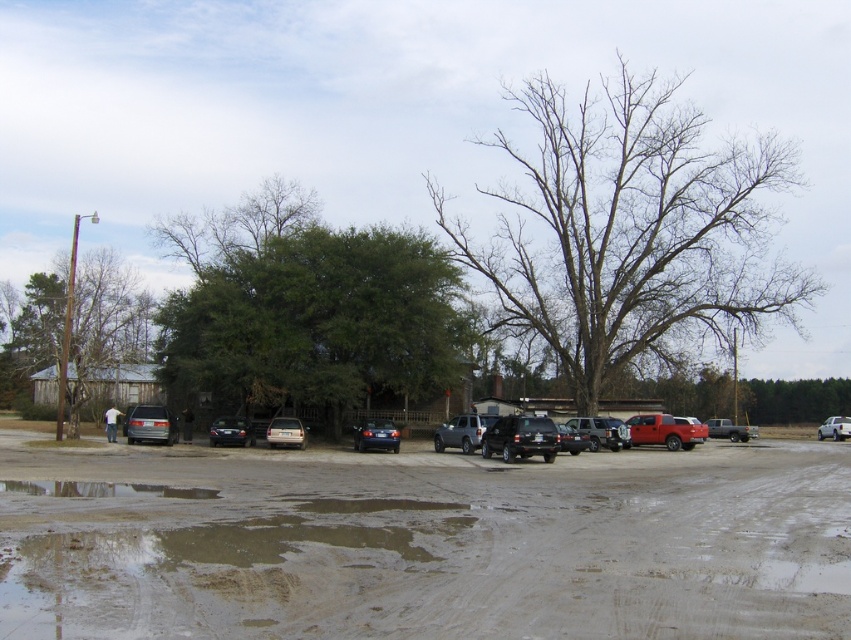
Question: Can you confirm if muddy dirt track at center is wider than matte black truck at center?

Choices:
 (A) yes
 (B) no

Answer: (A)

Question: Which of the following is the closest to the observer?

Choices:
 (A) metallic silver van at right
 (B) bare branches at center
 (C) matte black truck at center

Answer: (C)

Question: Which of the following is the closest to the observer?

Choices:
 (A) (629, 429)
 (B) (273, 428)

Answer: (B)

Question: Can you confirm if matte black truck at center is positioned below shiny black suv at center?

Choices:
 (A) yes
 (B) no

Answer: (A)

Question: Which point is farther to the camera?

Choices:
 (A) metallic silver van at right
 (B) satin blue sedan at center
 (C) green leafy tree at left

Answer: (A)

Question: Does matte silver van at left come behind metallic silver van at right?

Choices:
 (A) no
 (B) yes

Answer: (A)